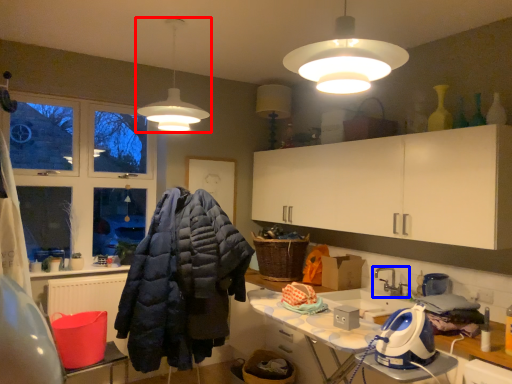
Question: Which object appears farthest to the camera in this image, lamp (highlighted by a red box) or tap (highlighted by a blue box)?

Choices:
 (A) lamp
 (B) tap

Answer: (B)